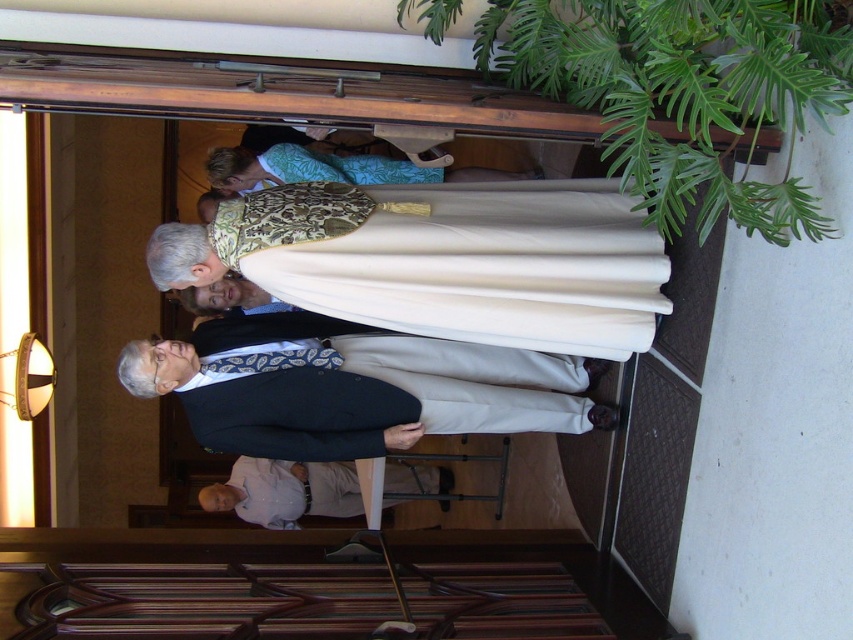
The width and height of the screenshot is (853, 640). What do you see at coordinates (355, 387) in the screenshot? I see `dark blue suit at center` at bounding box center [355, 387].

Between point (560, 397) and point (264, 486), which one is positioned behind?

The point (264, 486) is more distant.

The width and height of the screenshot is (853, 640). In order to click on dark blue suit at center in this screenshot , I will do `click(355, 387)`.